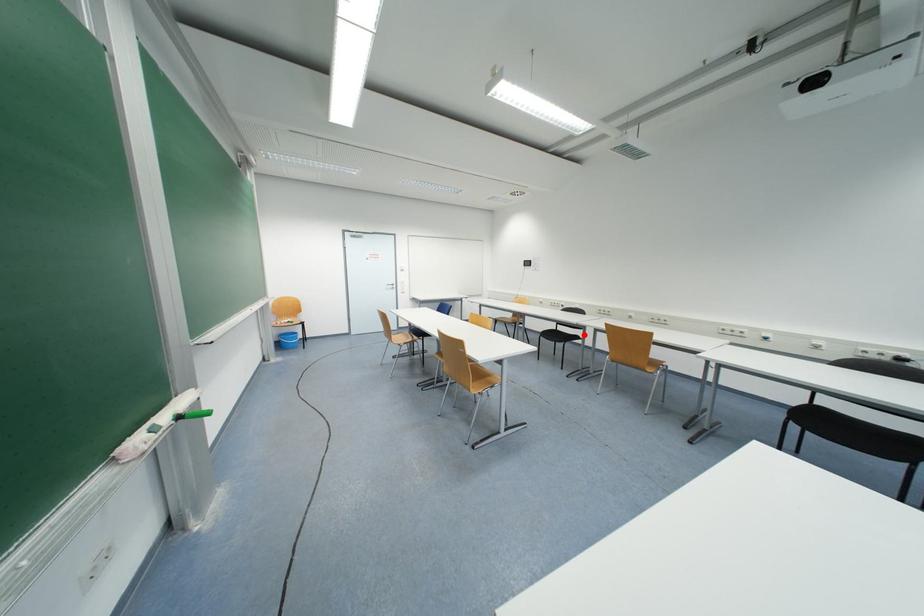
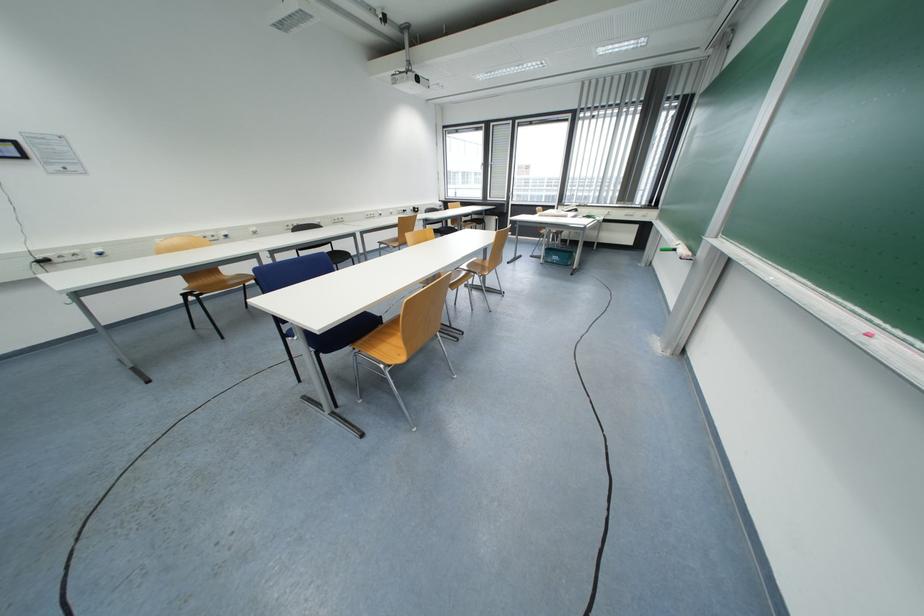
Question: I am providing you with two images of the same scene from different viewpoints. Image1 has a red point marked. In image2, the corresponding 3D location appears at what relative position? Reply with the corresponding letter.

Choices:
 (A) Closer
 (B) Farther

Answer: (A)